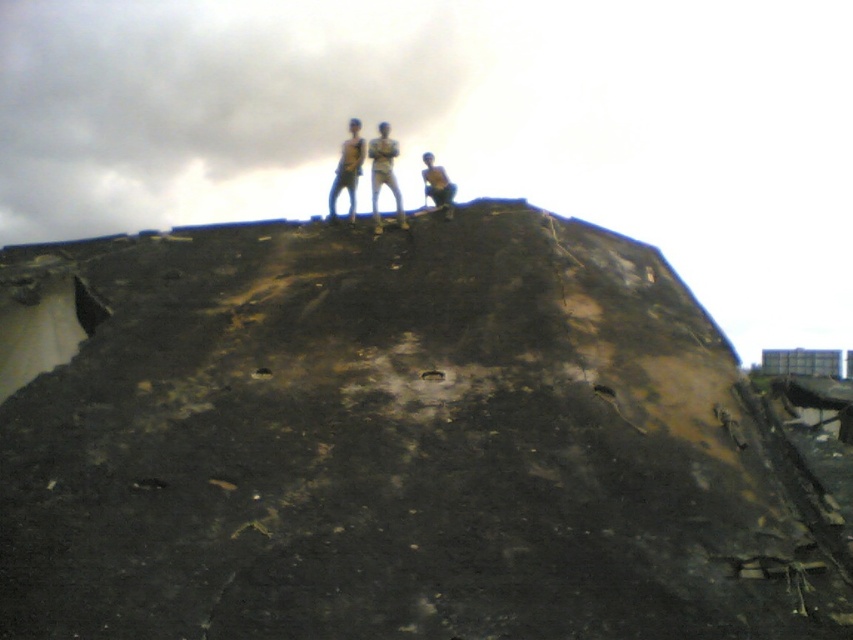
Who is more distant from viewer, (399,224) or (341,184)?

The point (341,184) is behind.

Is point (383, 132) positioned behind point (351, 186)?

No, it is in front of (351, 186).

Where is `light brown jeans at center`? light brown jeans at center is located at coordinates (383, 173).

I want to click on light brown jeans at center, so click(x=383, y=173).

Where is `charcoal textured mound at upper center`? charcoal textured mound at upper center is located at coordinates (393, 442).

Can you confirm if charcoal textured mound at upper center is positioned to the left of brown leather jacket at upper center?

Yes, charcoal textured mound at upper center is to the left of brown leather jacket at upper center.

Does point (131, 417) lie in front of point (438, 198)?

Yes, it is in front of point (438, 198).

At what (x,y) coordinates should I click in order to perform the action: click on charcoal textured mound at upper center. Please return your answer as a coordinate pair (x, y). The image size is (853, 640). Looking at the image, I should click on (393, 442).

Who is shorter, light brown jeans at center or brown leather jacket at upper center?

brown leather jacket at upper center

Find the location of `light brown jeans at center`. light brown jeans at center is located at coordinates (383, 173).